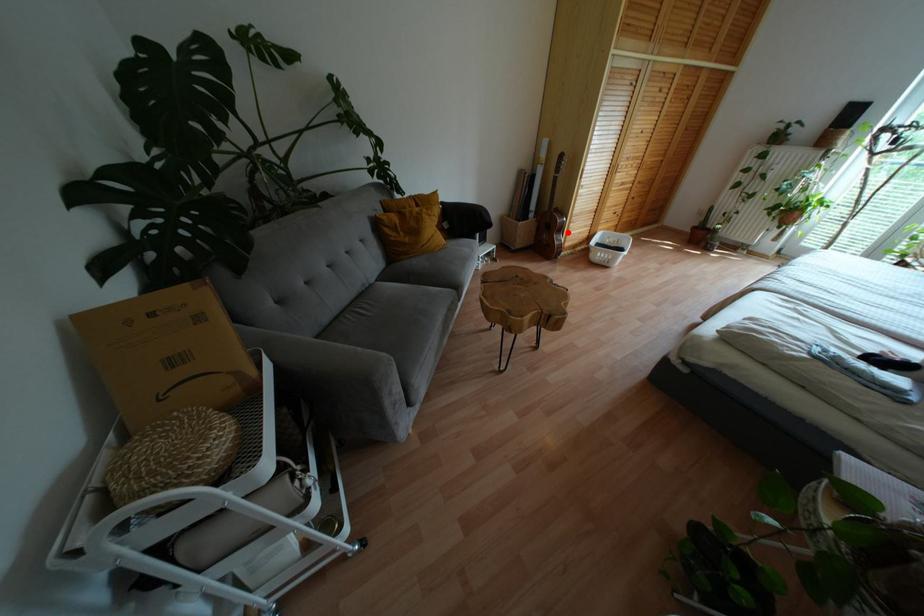
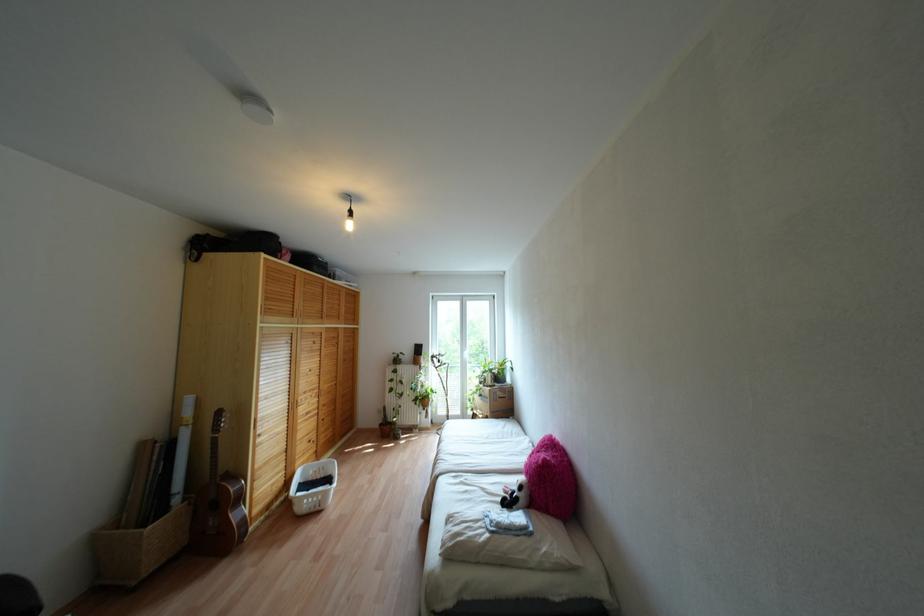
The point at the highlighted location is marked in the first image. Where is the corresponding point in the second image?

(253, 495)